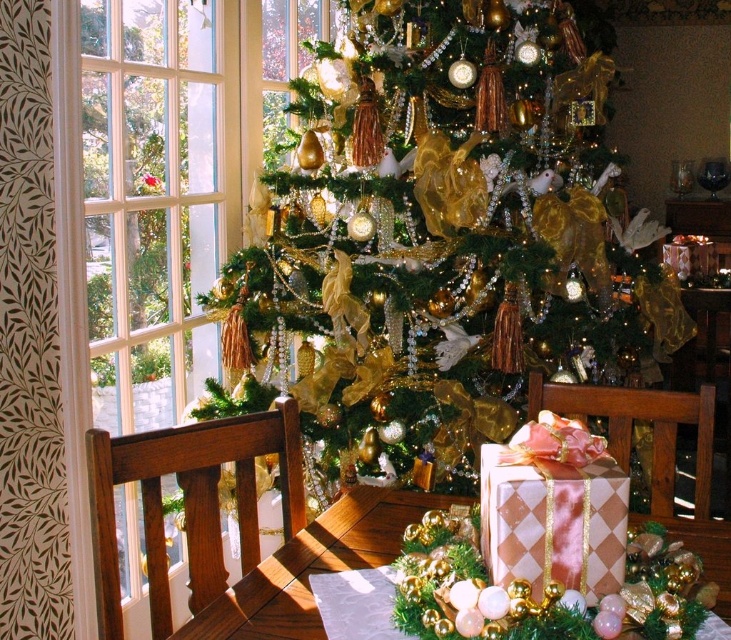
You are standing in front of the Christmas tree and want to see both the gold shiny ornaments at center and the clear glass window at left. Which object is closer to you?

The gold shiny ornaments at center are closer to you than the clear glass window at left because they are further to the viewer according to the description.

You are a guest at a Christmas party and want to take a photo of the clear glass window at left and the pink paper gift at center. Which object should you focus on first if you want to capture both in one shot without moving the camera?

You should focus on the pink paper gift at center first because the clear glass window at left is taller, so adjusting focus to the closer object ensures both are in frame.